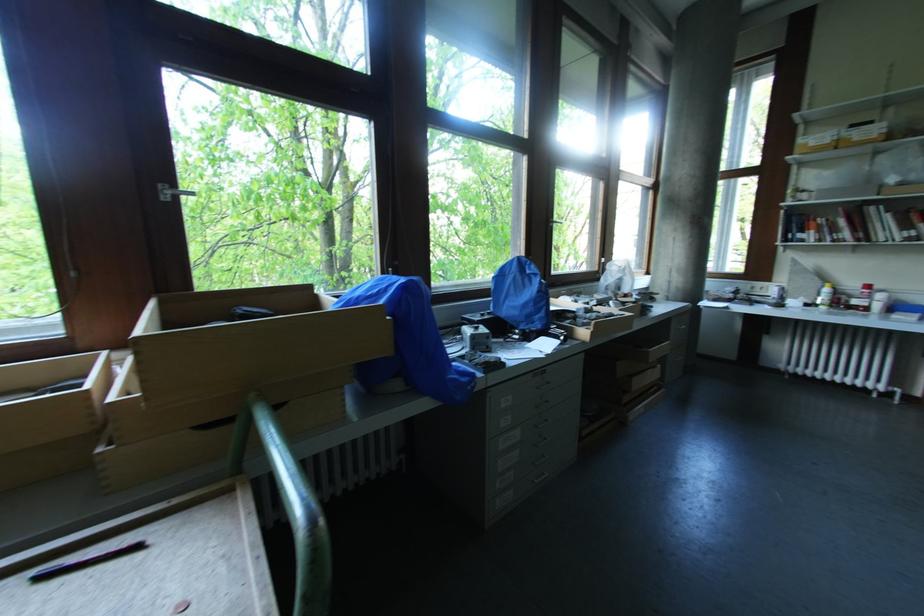
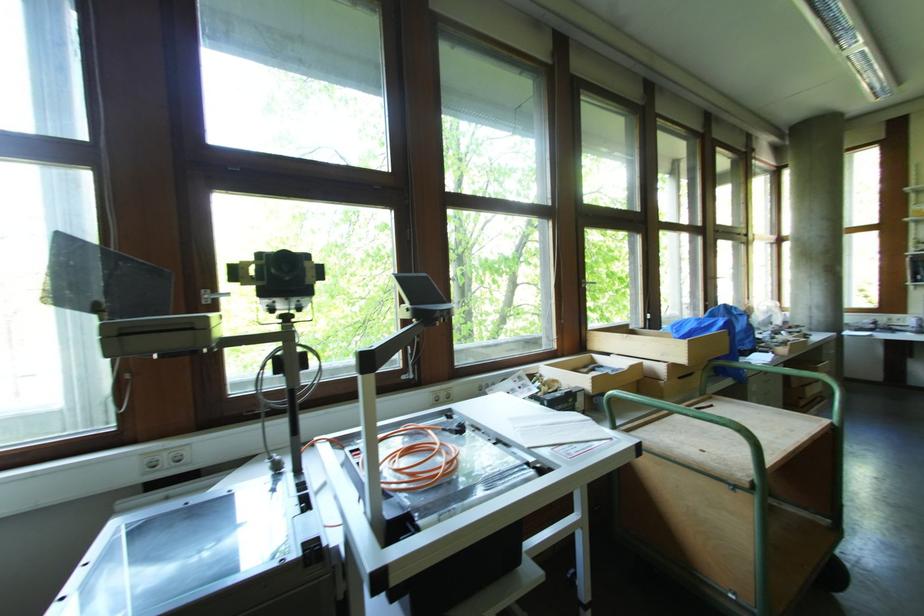
In the second image, find the point that corresponds to pixel 167 199 in the first image.

(586, 286)